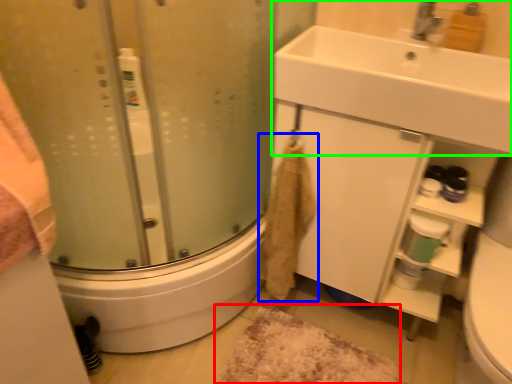
Question: Which is farther away from bath mat (highlighted by a red box)? bath towel (highlighted by a blue box) or sink (highlighted by a green box)?

Choices:
 (A) bath towel
 (B) sink

Answer: (B)